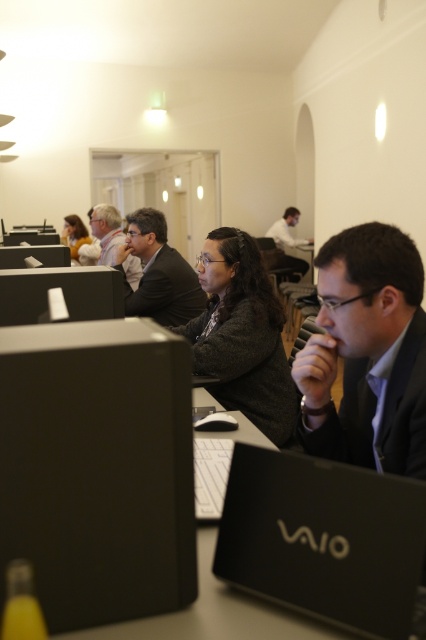
You are standing at the point labeled as point (285, 243) and want to move to the point labeled as point (256, 394). Is the destination point in front of your current position?

Yes, the point (256, 394) is in front of point (285, 243), so the destination is in front of your current position.

You are standing in front of the desk with the black VAIO laptop. There are two points marked on the desk surface. The first point is at coordinates point (92, 211) and the second at point (74, 241). Which point is closer to you?

Point (92, 211) is closer to the viewer than point (74, 241).

Looking at this image, you are standing in the office and want to reach a point that is exactly at coordinates point (291, 429). If your current position is 6 feet away from the camera, will you need to move forward or backward to reach that point?

The distance of point (291, 429) from the camera is 6.89 feet. Since you are currently 6 feet away from the camera, you need to move forward an additional 0.89 feet to reach the point.